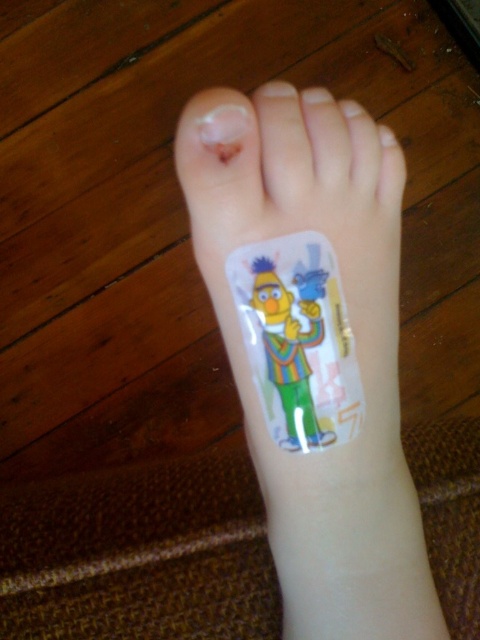
Question: Can you confirm if transparent adhesive bandage at lower center is positioned below clear plastic toe at upper center?

Choices:
 (A) no
 (B) yes

Answer: (B)

Question: Which point appears farthest from the camera in this image?

Choices:
 (A) (204, 125)
 (B) (296, 564)

Answer: (B)

Question: Does transparent adhesive bandage at lower center appear under clear plastic toe at upper center?

Choices:
 (A) no
 (B) yes

Answer: (B)

Question: Is transparent adhesive bandage at lower center to the right of clear plastic toe at upper center from the viewer's perspective?

Choices:
 (A) yes
 (B) no

Answer: (A)